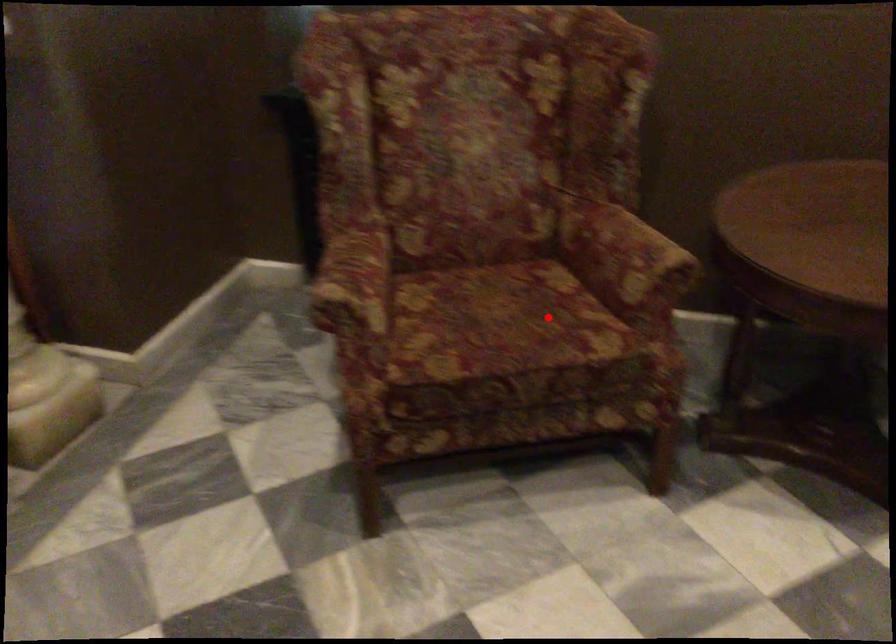
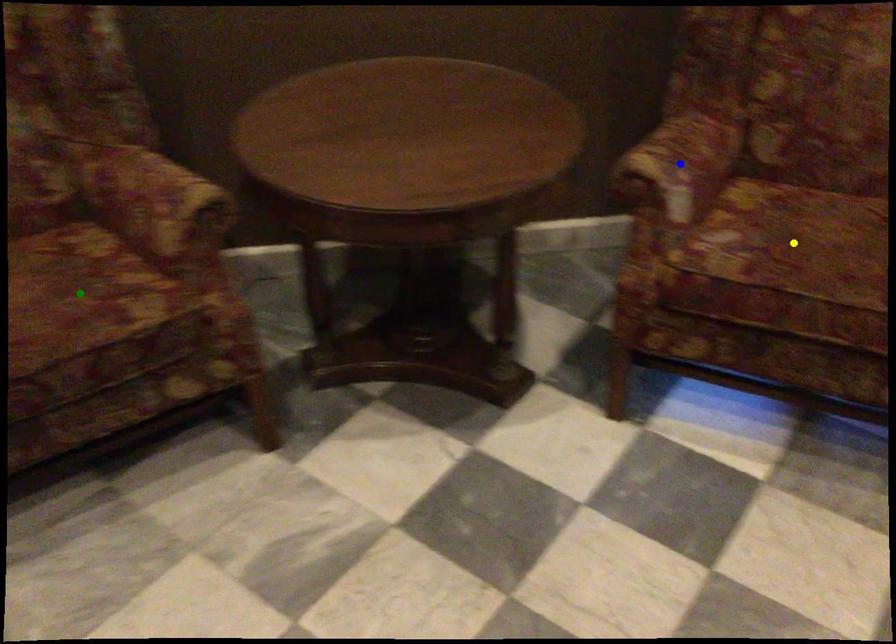
Question: I am providing you with two images of the same scene from different viewpoints. A red point is marked on the first image. You are given multiple points on the second image. In image 2, which mark is for the same physical point as the one in image 1?

Choices:
 (A) green point
 (B) blue point
 (C) yellow point

Answer: (A)